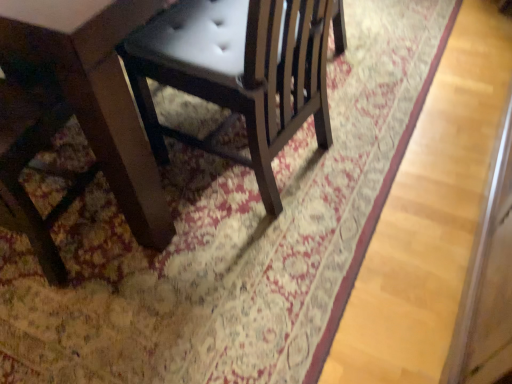
Identify the location of matte black chair at center. The height and width of the screenshot is (384, 512). (239, 72).

What is the approximate height of matte black chair at center?

matte black chair at center is 30.73 inches in height.

Describe the element at coordinates (239, 72) in the screenshot. I see `matte black chair at center` at that location.

What do you see at coordinates (79, 114) in the screenshot? I see `wooden table at lower left` at bounding box center [79, 114].

Measure the distance between wooden table at lower left and camera.

A distance of 29.48 inches exists between wooden table at lower left and camera.

At what (x,y) coordinates should I click in order to perform the action: click on wooden table at lower left. Please return your answer as a coordinate pair (x, y). Image resolution: width=512 pixels, height=384 pixels. Looking at the image, I should click on (79, 114).

Locate an element on the screen. matte black chair at center is located at coordinates (239, 72).

Is matte black chair at center at the left side of wooden table at lower left?

No.

Between matte black chair at center and wooden table at lower left, which one is positioned behind?

matte black chair at center is further away from the camera.

Is point (204, 149) positioned before point (63, 264)?

No.

From the image's perspective, does matte black chair at center appear higher than wooden table at lower left?

Correct, matte black chair at center appears higher than wooden table at lower left in the image.

From a real-world perspective, is matte black chair at center physically located above or below wooden table at lower left?

In terms of real-world spatial position, matte black chair at center is below wooden table at lower left.

Is matte black chair at center wider than wooden table at lower left?

Indeed, matte black chair at center has a greater width compared to wooden table at lower left.

In terms of height, does matte black chair at center look taller or shorter compared to wooden table at lower left?

matte black chair at center is shorter than wooden table at lower left.

Considering the sizes of objects matte black chair at center and wooden table at lower left in the image provided, who is bigger, matte black chair at center or wooden table at lower left?

matte black chair at center is bigger.

Is matte black chair at center surrounding wooden table at lower left?

No, wooden table at lower left is not a part of matte black chair at center.

Is matte black chair at center positioned far away from wooden table at lower left?

matte black chair at center is actually quite close to wooden table at lower left.

Is matte black chair at center positioned with its back to wooden table at lower left?

matte black chair at center is not turned away from wooden table at lower left.

What's the angular difference between matte black chair at center and wooden table at lower left's facing directions?

The angular difference between matte black chair at center and wooden table at lower left is 83.5 degrees.

This screenshot has height=384, width=512. Identify the location of chair that appears above the wooden table at lower left (from the image's perspective). (239, 72).

Considering the positions of objects wooden table at lower left and matte black chair at center in the image provided, who is more to the right, wooden table at lower left or matte black chair at center?

Positioned to the right is matte black chair at center.

Is wooden table at lower left behind matte black chair at center?

No, it is not.

Considering the points (68, 66) and (292, 29), which point is behind, point (68, 66) or point (292, 29)?

The point (292, 29) is behind.

From the image's perspective, would you say wooden table at lower left is shown under matte black chair at center?

Yes, from the image's perspective, wooden table at lower left is beneath matte black chair at center.

Based on the photo, from a real-world perspective, is wooden table at lower left positioned under matte black chair at center based on gravity?

Actually, wooden table at lower left is physically above matte black chair at center in the real world.

Between wooden table at lower left and matte black chair at center, which one has larger width?

With larger width is matte black chair at center.

Does wooden table at lower left have a greater height compared to matte black chair at center?

Correct, wooden table at lower left is much taller as matte black chair at center.

Can you confirm if wooden table at lower left is smaller than matte black chair at center?

Indeed, wooden table at lower left has a smaller size compared to matte black chair at center.

Is wooden table at lower left not inside matte black chair at center?

Yes, wooden table at lower left is outside of matte black chair at center.

Are wooden table at lower left and matte black chair at center located far from each other?

No, wooden table at lower left is not far away from matte black chair at center.

Is wooden table at lower left oriented away from matte black chair at center?

No, wooden table at lower left is not facing the opposite direction of matte black chair at center.

How different are the orientations of wooden table at lower left and matte black chair at center in degrees?

83.5 degrees.

Based on the photo, measure the distance from wooden table at lower left to matte black chair at center.

wooden table at lower left and matte black chair at center are 12.84 inches apart from each other.

In the image, there is a wooden table at lower left. What are the coordinates of `chair above it (from the image's perspective)` in the screenshot? It's located at (239, 72).

Where is `chair below the wooden table at lower left (from a real-world perspective)`? This screenshot has width=512, height=384. chair below the wooden table at lower left (from a real-world perspective) is located at coordinates (239, 72).

The height and width of the screenshot is (384, 512). Find the location of `table lying in front of the matte black chair at center`. table lying in front of the matte black chair at center is located at coordinates (79, 114).